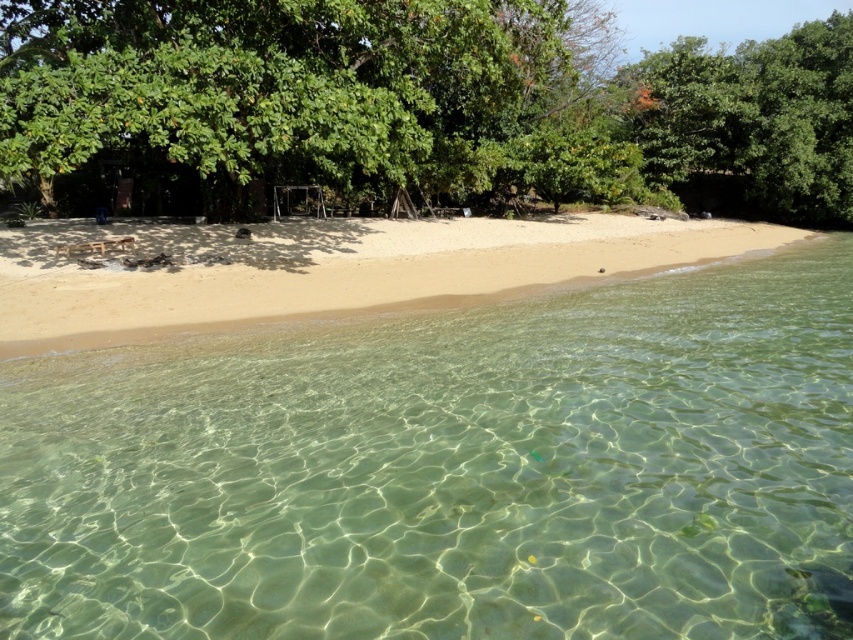
You are standing at the point marked as point (329, 268) in the image. What is the name of the location you are currently at?

You are standing at the sandy beach at center, which is located at point (329, 268).

You are standing on the beach and want to find the clear water at center. According to the scene description, where should you look relative to your position?

The clear water at center is located at point coordinates, so you should look towards the coordinates mentioned to find it.

You are standing on the sandy beach at center and want to walk towards the green leafy tree at upper right. Which direction should you head to reach the tree?

The green leafy tree at upper right is located in the upper right direction from the sandy beach at center, so you should head towards the upper right direction to reach the tree.